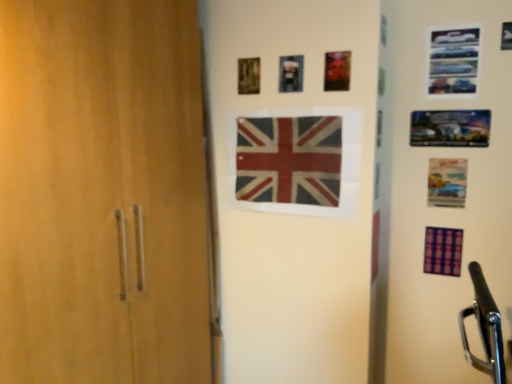
Question: In terms of height, does metallic silver picture frame at upper center, acting as the 3th picture frame starting from the right, look taller or shorter compared to purple fabric flag at lower right, the 2th flag when ordered from top to bottom?

Choices:
 (A) short
 (B) tall

Answer: (A)

Question: Considering the relative positions of metallic silver picture frame at upper center, placed as the 2th picture frame when sorted from left to right, and purple fabric flag at lower right, which is counted as the 2th flag, starting from the left, in the image provided, is metallic silver picture frame at upper center, placed as the 2th picture frame when sorted from left to right, to the left or to the right of purple fabric flag at lower right, which is counted as the 2th flag, starting from the left,?

Choices:
 (A) right
 (B) left

Answer: (B)

Question: Estimate the real-world distances between objects in this image. Which object is closer to the purple fabric flag at lower right, which is the 1th flag from right to left?

Choices:
 (A) metallic photo frame at upper right, which is the 3th picture frame in left-to-right order
 (B) metallic blue picture frame at upper right, which appears as the fourth picture frame when viewed from the left
 (C) metallic silver picture frame at upper center, placed as the 2th picture frame when sorted from left to right
 (D) red and white fabric flag at center, placed as the 1th flag when sorted from left to right
 (E) wooden picture frame at upper center, placed as the first picture frame when sorted from left to right

Answer: (A)

Question: Which is farther from the red and white fabric flag at center, the 1th flag positioned from the top?

Choices:
 (A) metallic blue picture frame at upper right, which ranks as the 1th picture frame in right-to-left order
 (B) metallic silver picture frame at upper center, acting as the 3th picture frame starting from the right
 (C) purple fabric flag at lower right, marked as the 1th flag in a bottom-to-top arrangement
 (D) metallic photo frame at upper right, which is the 3th picture frame in left-to-right order
 (E) wooden picture frame at upper center, which is the fourth picture frame in right-to-left order

Answer: (C)